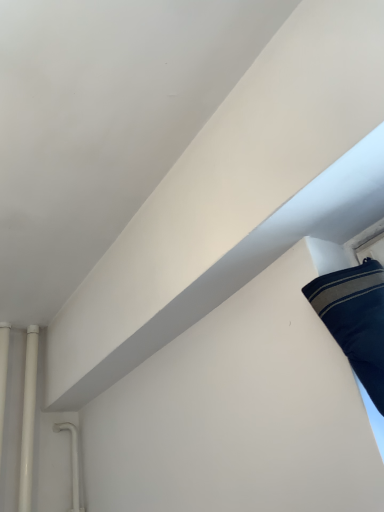
Question: Is white glossy pipe at left, marked as the first pipe in a right-to-left arrangement, shorter than white glossy pipe at left, the second pipe from the right?

Choices:
 (A) no
 (B) yes

Answer: (A)

Question: From a real-world perspective, is white glossy pipe at left, marked as the first pipe in a right-to-left arrangement, on white glossy pipe at left, the second pipe from the right?

Choices:
 (A) no
 (B) yes

Answer: (A)

Question: Does white glossy pipe at left, marked as the first pipe in a right-to-left arrangement, have a greater height compared to white glossy pipe at left, the second pipe from the right?

Choices:
 (A) yes
 (B) no

Answer: (A)

Question: From the image's perspective, does white glossy pipe at left, marked as the first pipe in a right-to-left arrangement, appear higher than white glossy pipe at left, marked as the first pipe in a left-to-right arrangement?

Choices:
 (A) no
 (B) yes

Answer: (A)

Question: Can you confirm if white glossy pipe at left, marked as the first pipe in a right-to-left arrangement, is thinner than white glossy pipe at left, marked as the first pipe in a left-to-right arrangement?

Choices:
 (A) yes
 (B) no

Answer: (B)

Question: From the image's perspective, would you say white glossy pipe at left, marked as the first pipe in a right-to-left arrangement, is shown under white glossy pipe at left, the second pipe from the right?

Choices:
 (A) no
 (B) yes

Answer: (B)

Question: From the image's perspective, is white glossy pipe at left, the second pipe from the right, located above white glossy pipe at left, marked as the first pipe in a right-to-left arrangement?

Choices:
 (A) yes
 (B) no

Answer: (A)

Question: From a real-world perspective, is white glossy pipe at left, the second pipe from the right, on top of white glossy pipe at left, the second pipe when ordered from left to right?

Choices:
 (A) no
 (B) yes

Answer: (B)

Question: Can you confirm if white glossy pipe at left, marked as the first pipe in a left-to-right arrangement, is thinner than white glossy pipe at left, marked as the first pipe in a right-to-left arrangement?

Choices:
 (A) yes
 (B) no

Answer: (A)

Question: Is white glossy pipe at left, marked as the first pipe in a left-to-right arrangement, bigger than white glossy pipe at left, marked as the first pipe in a right-to-left arrangement?

Choices:
 (A) yes
 (B) no

Answer: (B)

Question: Would you say white glossy pipe at left, marked as the first pipe in a left-to-right arrangement, is outside white glossy pipe at left, the second pipe when ordered from left to right?

Choices:
 (A) yes
 (B) no

Answer: (A)

Question: Does white glossy pipe at left, the second pipe from the right, come in front of white glossy pipe at left, the second pipe when ordered from left to right?

Choices:
 (A) no
 (B) yes

Answer: (B)

Question: Considering their positions, is white glossy pipe at left, marked as the first pipe in a right-to-left arrangement, located in front of or behind white glossy pipe at left, marked as the first pipe in a left-to-right arrangement?

Choices:
 (A) front
 (B) behind

Answer: (B)